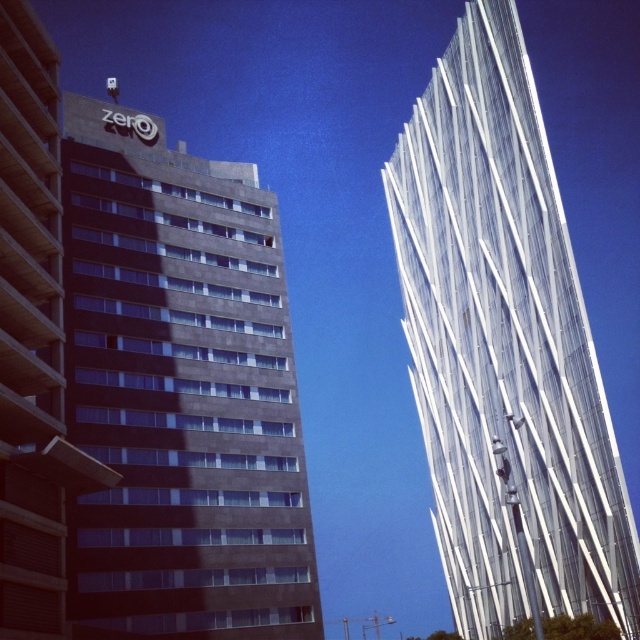
Can you confirm if dark gray concrete building at center is thinner than dark gray concrete building at left?

In fact, dark gray concrete building at center might be wider than dark gray concrete building at left.

Is dark gray concrete building at center shorter than dark gray concrete building at left?

No, dark gray concrete building at center is not shorter than dark gray concrete building at left.

Between point (65, 250) and point (26, 196), which one is positioned behind?

Point (65, 250)

Locate an element on the screen. This screenshot has width=640, height=640. dark gray concrete building at center is located at coordinates (180, 392).

Is dark gray concrete building at center above transparent glass tower at right?

Yes.

Who is positioned more to the left, dark gray concrete building at center or transparent glass tower at right?

dark gray concrete building at center is more to the left.

Is point (316, 608) less distant than point (444, 104)?

That is True.

Locate an element on the screen. dark gray concrete building at center is located at coordinates (180, 392).

Between transparent glass tower at right and dark gray concrete building at left, which one has less height?

dark gray concrete building at left

Does point (499, 252) lie in front of point (22, 422)?

No, (499, 252) is further to viewer.

The width and height of the screenshot is (640, 640). In order to click on transparent glass tower at right in this screenshot , I will do `click(504, 344)`.